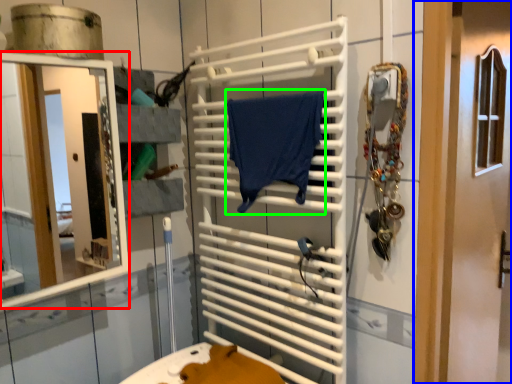
Question: Estimate the real-world distances between objects in this image. Which object is closer to mirror (highlighted by a red box), door (highlighted by a blue box) or bath towel (highlighted by a green box)?

Choices:
 (A) door
 (B) bath towel

Answer: (B)